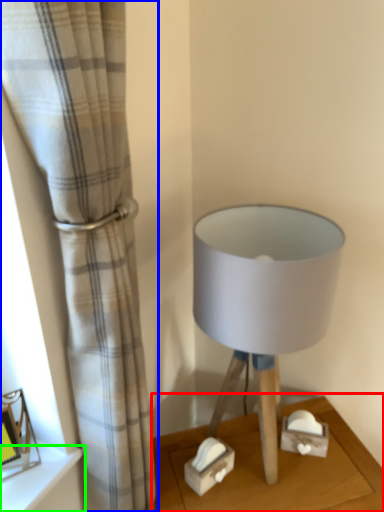
Question: Which object is positioned closest to table (highlighted by a red box)? Select from curtain (highlighted by a blue box) and shelf (highlighted by a green box).

Choices:
 (A) curtain
 (B) shelf

Answer: (B)